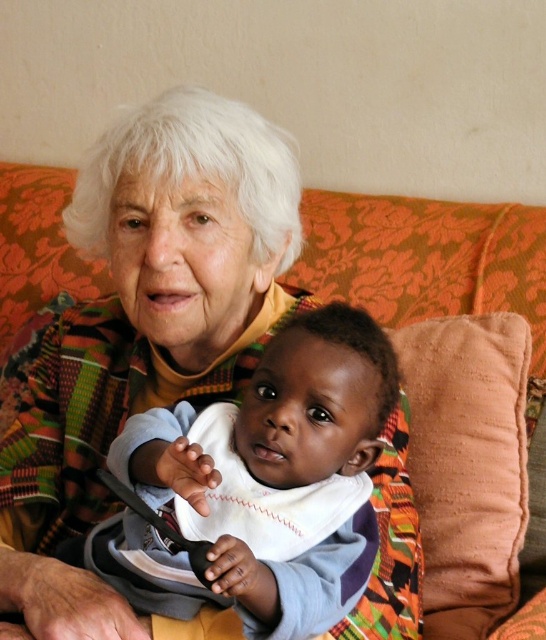
Question: Estimate the real-world distances between objects in this image. Which object is closer to the white soft bib at center?

Choices:
 (A) coral velvety pillow at right
 (B) orange floral fabric couch at center

Answer: (A)

Question: Can you confirm if white soft bib at center is wider than orange floral fabric couch at center?

Choices:
 (A) yes
 (B) no

Answer: (B)

Question: Which point is closer to the camera?

Choices:
 (A) white soft bib at center
 (B) orange floral fabric couch at center

Answer: (A)

Question: From the image, what is the correct spatial relationship of orange floral fabric couch at center in relation to coral velvety pillow at right?

Choices:
 (A) left
 (B) right

Answer: (B)

Question: Which point is closer to the camera?

Choices:
 (A) (532, 337)
 (B) (424, 566)
 (C) (377, 372)

Answer: (C)

Question: In this image, where is white soft bib at center located relative to orange floral fabric couch at center?

Choices:
 (A) below
 (B) above

Answer: (A)